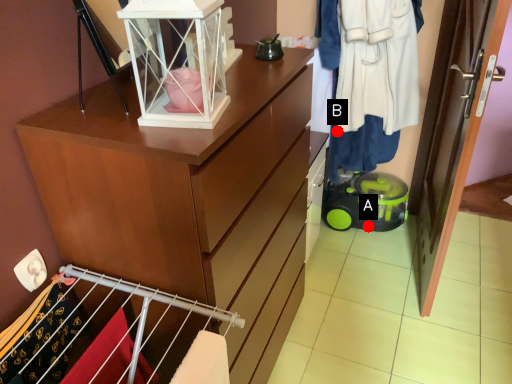
Question: Two points are circled on the image, labeled by A and B beside each circle. Which of the following is the farthest from the observer?

Choices:
 (A) A is further
 (B) B is further

Answer: (A)